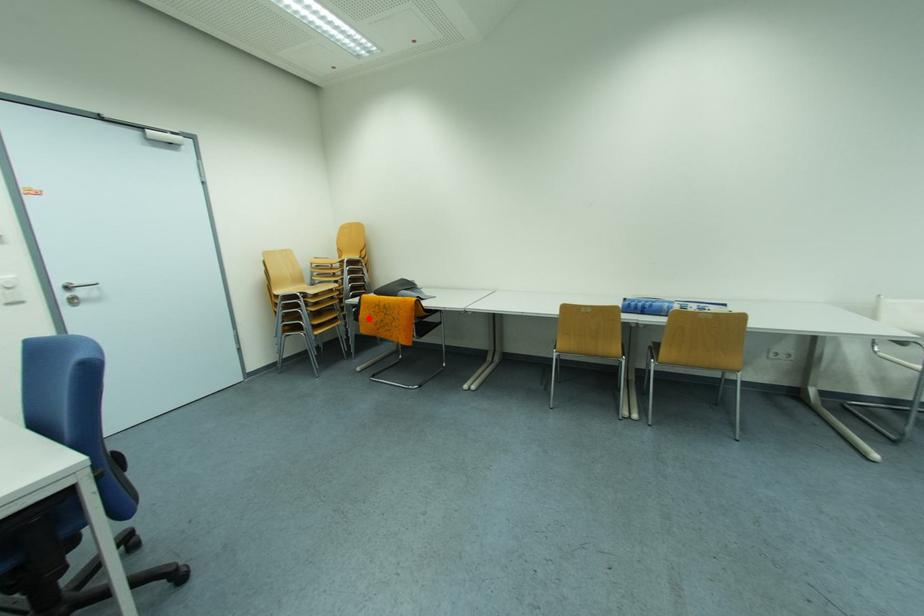
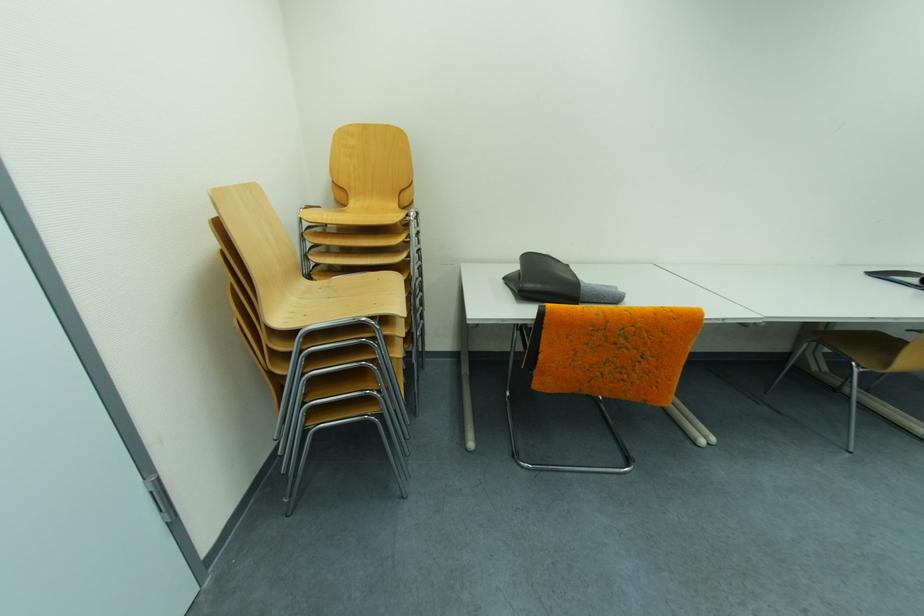
Question: A red point is marked in image1. In image2, is the corresponding 3D point closer to the camera or farther? Reply with the corresponding letter.

Choices:
 (A) The corresponding 3D point is closer.
 (B) The corresponding 3D point is farther.

Answer: (A)